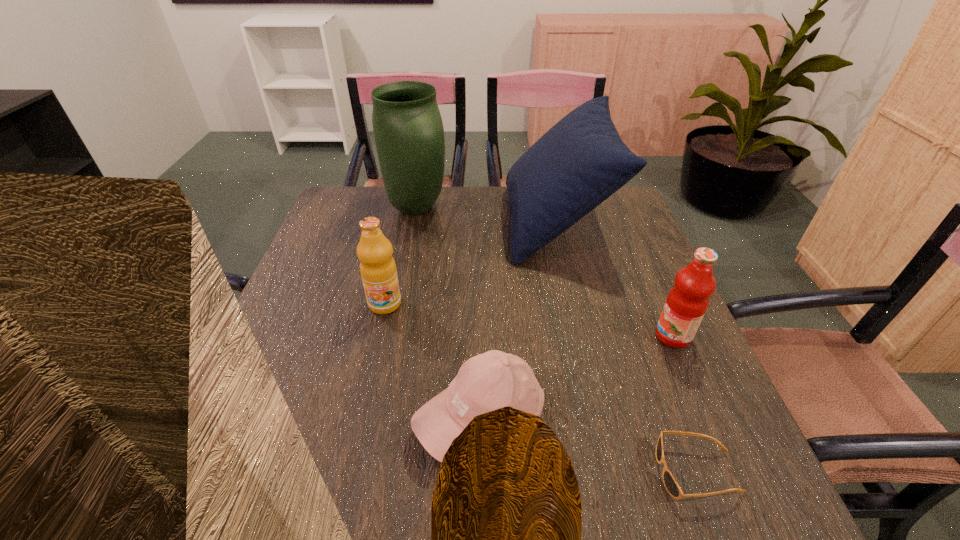
Where is `vacant position in the image that satisfies the following two spatial constraints: 1. on the front label of the nearer fruit juice; 2. on the front-facing side of the second shortest object`? The width and height of the screenshot is (960, 540). vacant position in the image that satisfies the following two spatial constraints: 1. on the front label of the nearer fruit juice; 2. on the front-facing side of the second shortest object is located at coordinates [708, 418].

The image size is (960, 540). What are the coordinates of `free location that satisfies the following two spatial constraints: 1. on the facing side of the cushion; 2. on the front label of the farther fruit juice` in the screenshot? It's located at (575, 304).

Locate an element on the screen. vacant region that satisfies the following two spatial constraints: 1. on the front label of the nearer fruit juice; 2. on the front-facing side of the second shortest object is located at coordinates (708, 418).